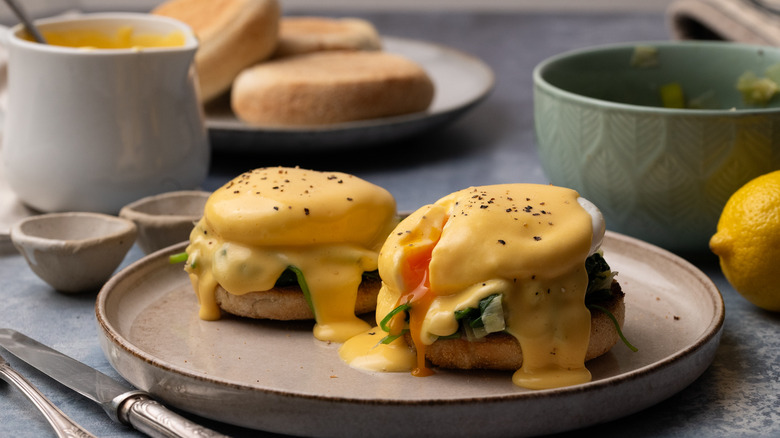
The width and height of the screenshot is (780, 438). In order to click on plate in this screenshot , I will do `click(452, 85)`, `click(256, 383)`.